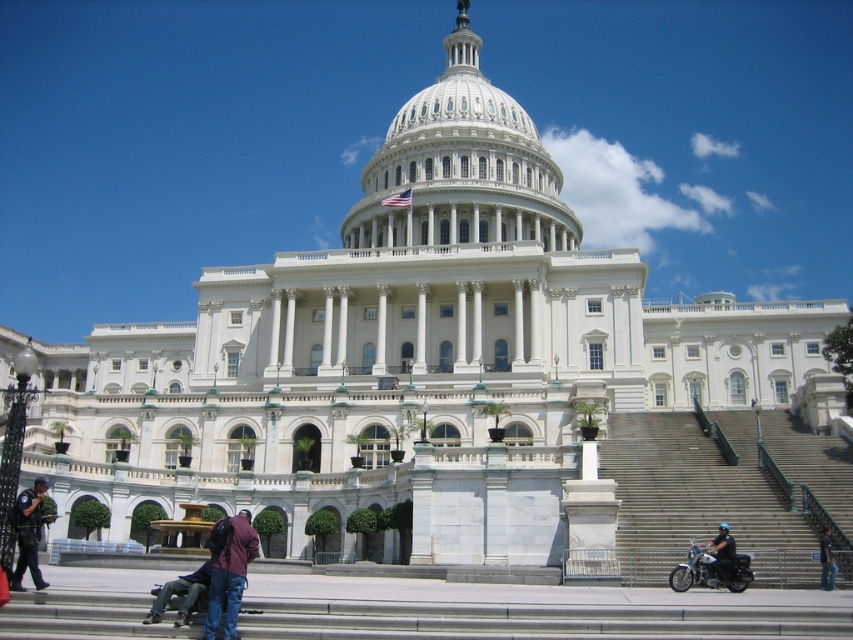
You are standing at the base of the United States Capitol Building and see two points marked in the scene. The first is labeled as point (454, 58) and the second as point (233, 592). Which point is closer to you?

Point (454, 58) is closer to you because it is further to the viewer than point (233, 592).

You are a tourist visiting the United States Capitol Building. You see the white marble dome at center and the jeans at lower right. Which object appears larger in the image?

The white marble dome at center appears larger than the jeans at lower right.